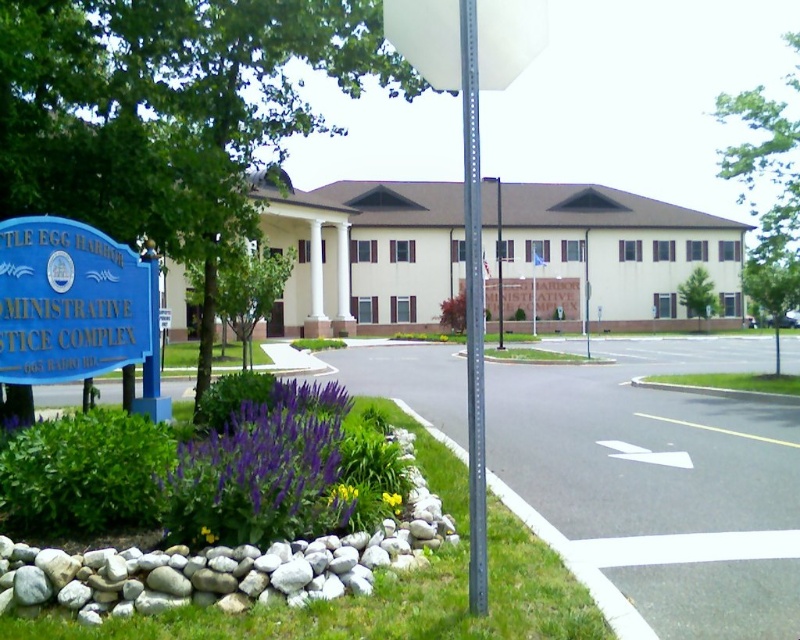
What does the point at coordinates (70,301) represent in the image?

The point at coordinates (70,301) corresponds to the blue plastic sign at left.

You are a landscape designer planning to replace the purple matte flower at lower center with a larger one. Considering the space available, will the new flower fit if it is the same size as the white plastic sign at upper center?

The purple matte flower at lower center is narrower than the white plastic sign at upper center. Since the new flower would be as wide as the sign, it might not fit in the current space allocated for the flower unless adjustments are made to the surrounding area.

What is the object located at the coordinates point (70, 301)?

The point (70, 301) corresponds to the blue plastic sign at left.